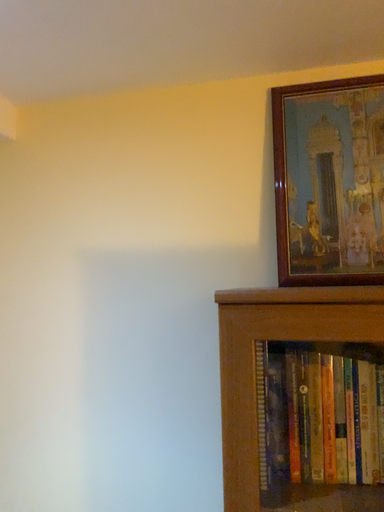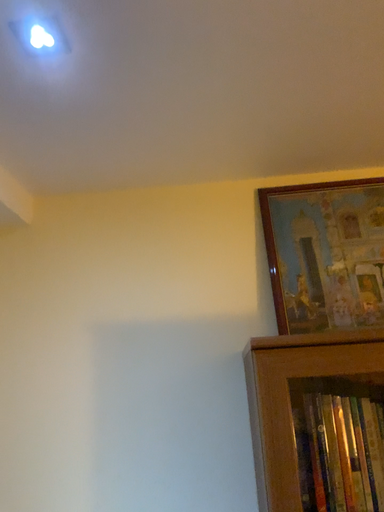
Question: Which way did the camera rotate in the video?

Choices:
 (A) rotated upward
 (B) rotated downward

Answer: (A)